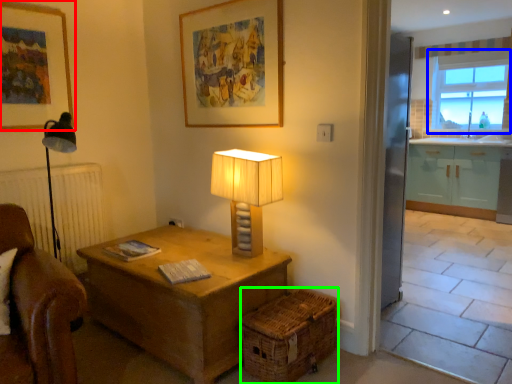
Question: Which object is the closest to the picture frame (highlighted by a red box)? Choose among these: window (highlighted by a blue box) or crate (highlighted by a green box).

Choices:
 (A) window
 (B) crate

Answer: (B)